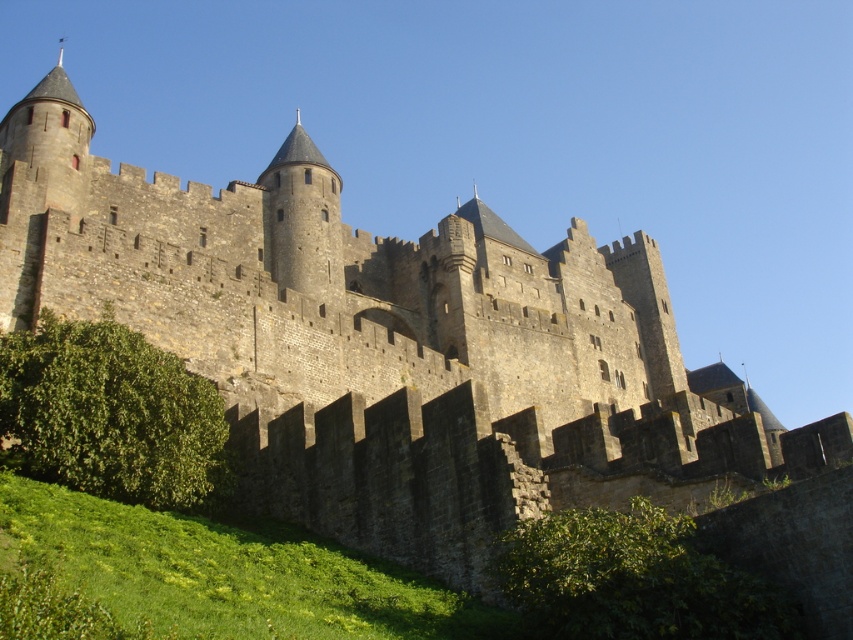
You are a gardener planning to trim the green leafy hedge at lower left and the green leafy hedge at lower center. Based on their sizes, which hedge requires more time and effort to maintain?

The green leafy hedge at lower left requires more time and effort to maintain because it is larger in size than the green leafy hedge at lower center.

You are standing at the center of the castle courtyard and looking towards the main entrance. Which direction should you walk to avoid the green leafy hedge at lower left?

Since the green leafy hedge at lower left is located at point (111, 413), which is in the lower left area of the image, you should walk towards the right or upper direction to avoid it.

You are a gardener planning to plant a row of flowers between the green leafy hedge at lower left and the green leafy hedge at lower center. Which hedge has more space available for planting the flowers?

The green leafy hedge at lower left has a larger width than the green leafy hedge at lower center, so there is more space available for planting flowers between them.